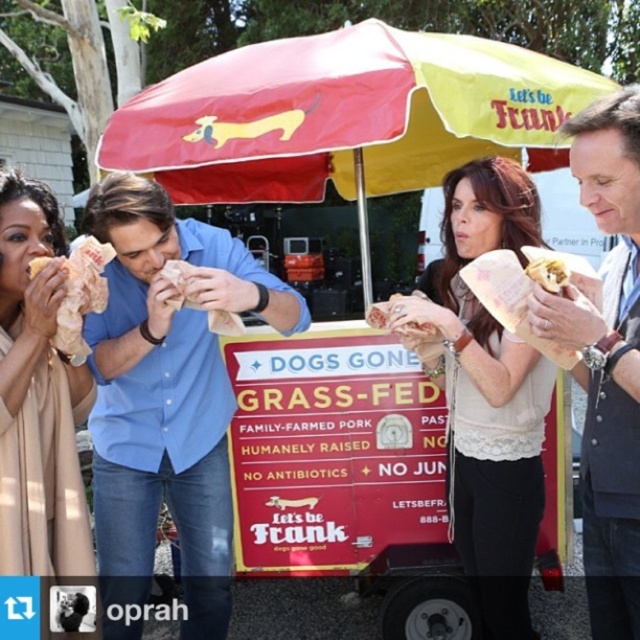
Is matte beige blouse at center thinner than grass-fed cart at center?

No.

How much distance is there between matte beige blouse at center and grass-fed cart at center?

matte beige blouse at center and grass-fed cart at center are 16.78 inches apart from each other.

Is point (448, 244) positioned behind point (630, 305)?

Yes, point (448, 244) is behind point (630, 305).

At what (x,y) coordinates should I click in order to perform the action: click on matte beige blouse at center. Please return your answer as a coordinate pair (x, y). This screenshot has height=640, width=640. Looking at the image, I should click on (486, 394).

Which is above, golden crispy chicken at left or matte paper sandwich at center?

matte paper sandwich at center is higher up.

In the scene shown: Who is more distant from viewer, (99, 257) or (552, 269)?

The point (99, 257) is more distant.

Describe the element at coordinates (81, 294) in the screenshot. The image size is (640, 640). I see `golden crispy chicken at left` at that location.

Identify the location of golden crispy chicken at left. This screenshot has height=640, width=640. (81, 294).

Is point (544, 145) closer to viewer compared to point (384, 307)?

No, (544, 145) is behind (384, 307).

Who is positioned more to the right, polyester umbrella at center or grilled meat sandwich at center?

Positioned to the right is grilled meat sandwich at center.

Does point (408, 74) come farther from viewer compared to point (374, 305)?

No, (408, 74) is closer to viewer.

The height and width of the screenshot is (640, 640). In order to click on polyester umbrella at center in this screenshot , I will do `click(344, 115)`.